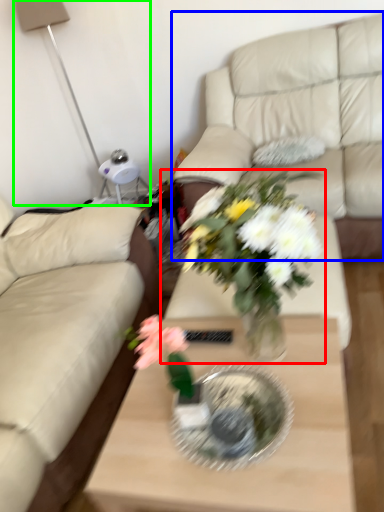
Question: Based on their relative distances, which object is farther from houseplant (highlighted by a red box)? Choose from studio couch (highlighted by a blue box) and table lamp (highlighted by a green box).

Choices:
 (A) studio couch
 (B) table lamp

Answer: (B)